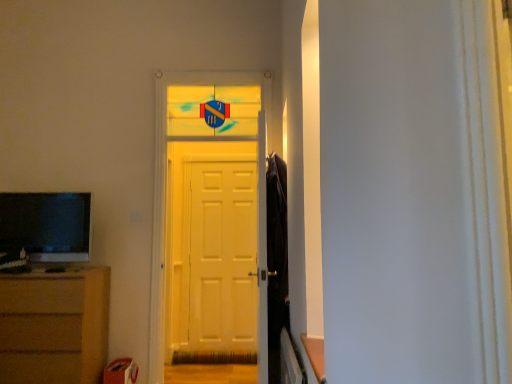
Locate an element on the screen. blank space situated above white glossy door at center (from a real-world perspective) is located at coordinates (212, 69).